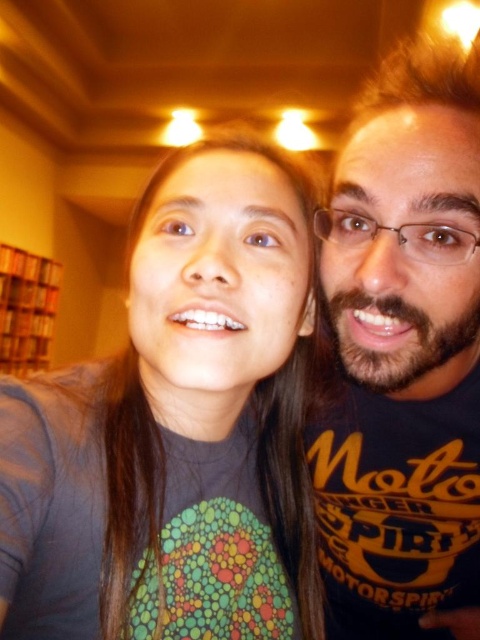
Is gray matte shirt at center bigger than dark blue t-shirt at right?

No, gray matte shirt at center is not bigger than dark blue t-shirt at right.

Based on the photo, does gray matte shirt at center have a lesser width compared to dark blue t-shirt at right?

Yes.

The image size is (480, 640). What are the coordinates of `gray matte shirt at center` in the screenshot? It's located at (177, 429).

Is dark blue t-shirt at right bigger than wooden bookshelf at left?

Actually, dark blue t-shirt at right might be smaller than wooden bookshelf at left.

Does dark blue t-shirt at right have a lesser height compared to wooden bookshelf at left?

Yes, dark blue t-shirt at right is shorter than wooden bookshelf at left.

Which is behind, point (466, 86) or point (43, 340)?

Point (43, 340)

This screenshot has height=640, width=480. I want to click on dark blue t-shirt at right, so click(x=403, y=356).

Measure the distance between point (101,609) and camera.

Point (101,609) is 16.31 inches away from camera.

Is gray matte shirt at center to the right of wooden bookshelf at left from the viewer's perspective?

Yes, gray matte shirt at center is to the right of wooden bookshelf at left.

Between point (287, 412) and point (33, 310), which one is positioned behind?

Point (33, 310)

Where is `gray matte shirt at center`? This screenshot has width=480, height=640. gray matte shirt at center is located at coordinates (177, 429).